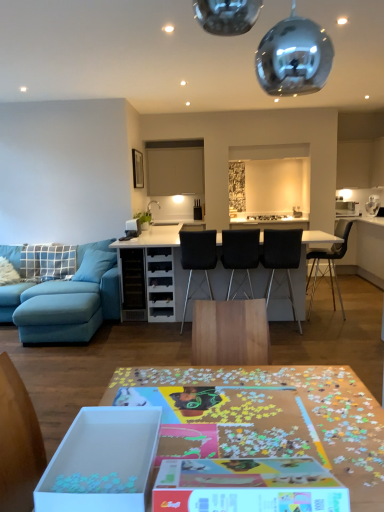
Question: Should I look upward or downward to see black fabric chair at center, the 4th chair viewed from the right?

Choices:
 (A) up
 (B) down

Answer: (B)

Question: Is black matte chair at center, placed as the 2th chair when sorted from left to right, aimed at white cardboard box at lower left?

Choices:
 (A) no
 (B) yes

Answer: (A)

Question: Can you confirm if black matte chair at center, placed as the 2th chair when sorted from left to right, is shorter than white cardboard box at lower left?

Choices:
 (A) no
 (B) yes

Answer: (A)

Question: Is white cardboard box at lower left a part of black matte chair at center, placed as the 2th chair when sorted from left to right?

Choices:
 (A) yes
 (B) no

Answer: (B)

Question: Is black matte chair at center, placed as the third chair when sorted from right to left, touching white cardboard box at lower left?

Choices:
 (A) no
 (B) yes

Answer: (A)

Question: Is black matte chair at center, placed as the 2th chair when sorted from left to right, positioned before white cardboard box at lower left?

Choices:
 (A) yes
 (B) no

Answer: (B)

Question: Is black matte chair at center, placed as the 2th chair when sorted from left to right, to the right of white cardboard box at lower left from the viewer's perspective?

Choices:
 (A) no
 (B) yes

Answer: (B)

Question: Does black fabric chair at center, the 4th chair viewed from the right, have a lesser height compared to wooden puzzle pieces at center, the 1th table when ordered from front to back?

Choices:
 (A) yes
 (B) no

Answer: (B)

Question: From the image's perspective, is black fabric chair at center, positioned as the first chair in left-to-right order, below wooden puzzle pieces at center, which is the second table in back-to-front order?

Choices:
 (A) no
 (B) yes

Answer: (A)

Question: Is black fabric chair at center, positioned as the first chair in left-to-right order, taller than wooden puzzle pieces at center, which is the second table in back-to-front order?

Choices:
 (A) no
 (B) yes

Answer: (B)

Question: Is black fabric chair at center, positioned as the first chair in left-to-right order, to the right of wooden puzzle pieces at center, the 1th table when ordered from front to back, from the viewer's perspective?

Choices:
 (A) no
 (B) yes

Answer: (A)

Question: Is black fabric chair at center, positioned as the first chair in left-to-right order, turned away from wooden puzzle pieces at center, the 1th table when ordered from front to back?

Choices:
 (A) no
 (B) yes

Answer: (B)

Question: Is black fabric chair at center, positioned as the first chair in left-to-right order, with wooden puzzle pieces at center, which is the second table in back-to-front order?

Choices:
 (A) yes
 (B) no

Answer: (B)

Question: Does white cardboard box at lower left have a lesser height compared to black fabric chair at center, the 4th chair viewed from the right?

Choices:
 (A) no
 (B) yes

Answer: (B)